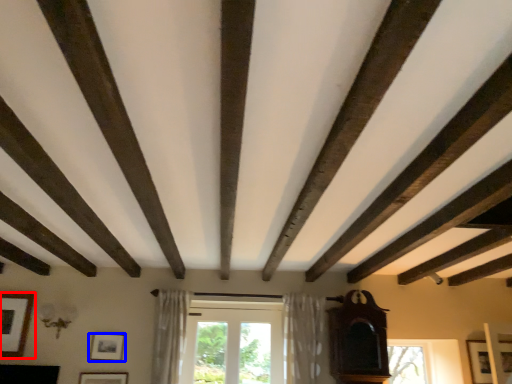
Question: Which object is further to the camera taking this photo, picture frame (highlighted by a red box) or picture frame (highlighted by a blue box)?

Choices:
 (A) picture frame
 (B) picture frame

Answer: (B)